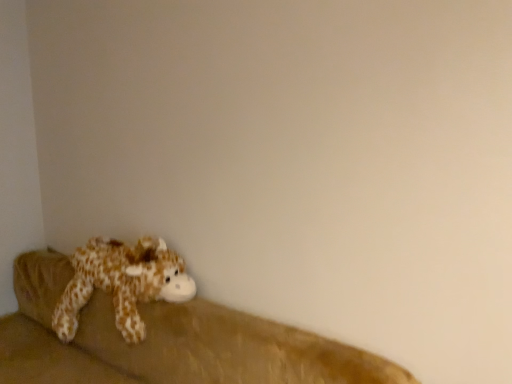
Question: Can you confirm if brown plush couch at lower left is wider than fluffy brown plush giraffe at lower left?

Choices:
 (A) no
 (B) yes

Answer: (B)

Question: Can you confirm if brown plush couch at lower left is bigger than fluffy brown plush giraffe at lower left?

Choices:
 (A) yes
 (B) no

Answer: (A)

Question: Is brown plush couch at lower left positioned beyond the bounds of fluffy brown plush giraffe at lower left?

Choices:
 (A) yes
 (B) no

Answer: (A)

Question: Does brown plush couch at lower left appear on the left side of fluffy brown plush giraffe at lower left?

Choices:
 (A) no
 (B) yes

Answer: (A)

Question: Is brown plush couch at lower left touching fluffy brown plush giraffe at lower left?

Choices:
 (A) yes
 (B) no

Answer: (B)

Question: Are brown plush couch at lower left and fluffy brown plush giraffe at lower left far apart?

Choices:
 (A) no
 (B) yes

Answer: (A)

Question: Would you say brown plush couch at lower left is part of fluffy brown plush giraffe at lower left's contents?

Choices:
 (A) yes
 (B) no

Answer: (B)

Question: From a real-world perspective, is fluffy brown plush giraffe at lower left on top of brown plush couch at lower left?

Choices:
 (A) yes
 (B) no

Answer: (A)

Question: Can you confirm if fluffy brown plush giraffe at lower left is thinner than brown plush couch at lower left?

Choices:
 (A) yes
 (B) no

Answer: (A)

Question: Is fluffy brown plush giraffe at lower left positioned before brown plush couch at lower left?

Choices:
 (A) yes
 (B) no

Answer: (B)

Question: Does fluffy brown plush giraffe at lower left have a smaller size compared to brown plush couch at lower left?

Choices:
 (A) no
 (B) yes

Answer: (B)

Question: From the image's perspective, is fluffy brown plush giraffe at lower left under brown plush couch at lower left?

Choices:
 (A) yes
 (B) no

Answer: (B)

Question: From the image's perspective, is brown plush couch at lower left positioned above or below fluffy brown plush giraffe at lower left?

Choices:
 (A) above
 (B) below

Answer: (B)